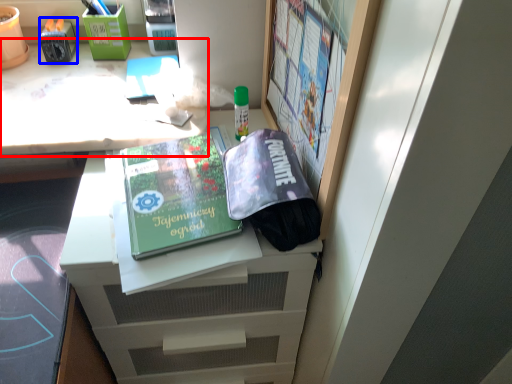
Question: Which point is closer to the camera, desk (highlighted by a red box) or stationery (highlighted by a blue box)?

Choices:
 (A) desk
 (B) stationery

Answer: (A)